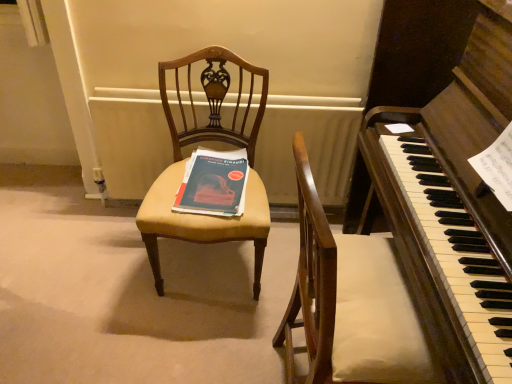
Where is `blank space to the left of white painted radiator at center`? The image size is (512, 384). blank space to the left of white painted radiator at center is located at coordinates (64, 234).